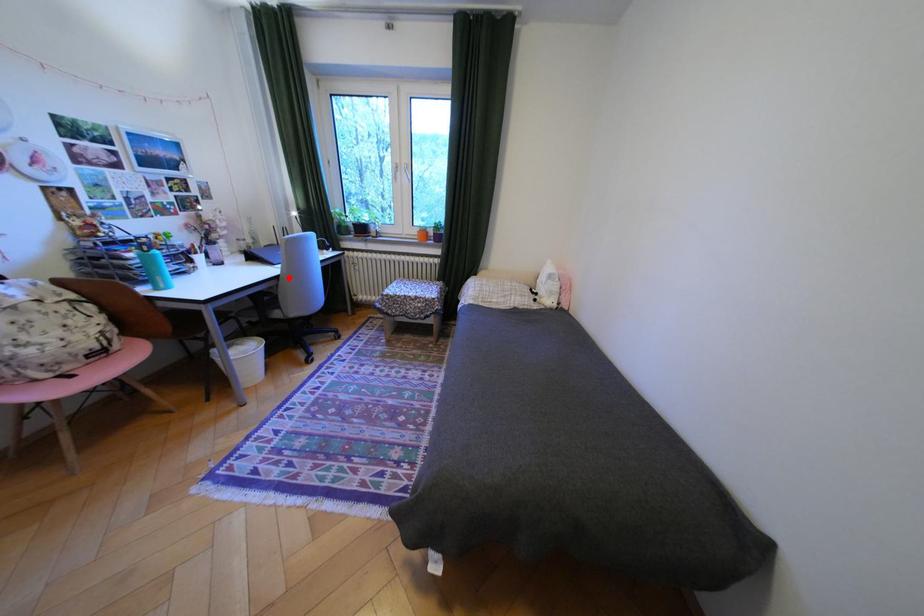
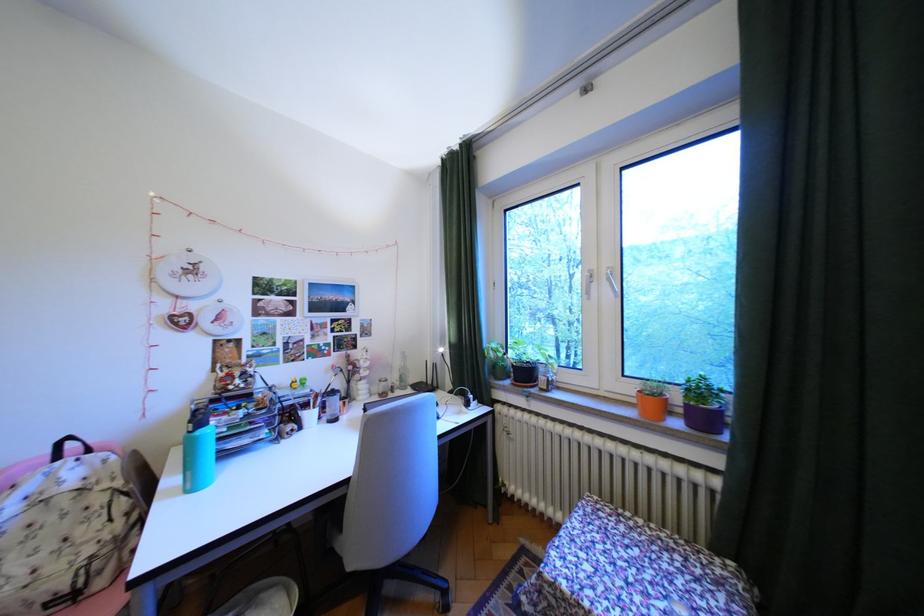
Find the pixel in the second image that matches the highlighted location in the first image.

(359, 483)